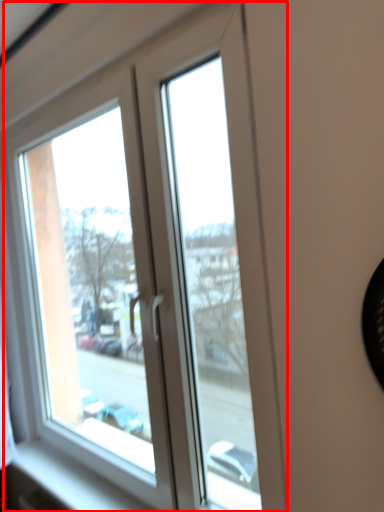
Question: Observing the image, what is the correct spatial positioning of window (annotated by the red box) in reference to window sill?

Choices:
 (A) right
 (B) left

Answer: (A)